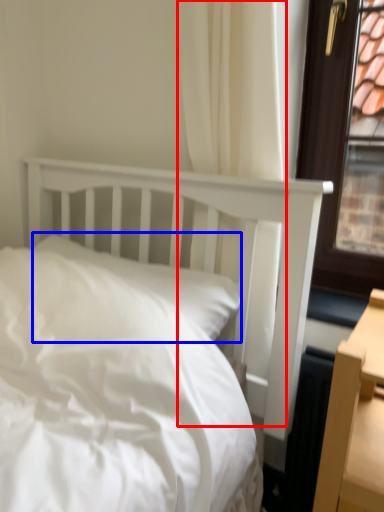
Question: Which point is closer to the camera, curtain (highlighted by a red box) or pillow (highlighted by a blue box)?

Choices:
 (A) curtain
 (B) pillow

Answer: (A)